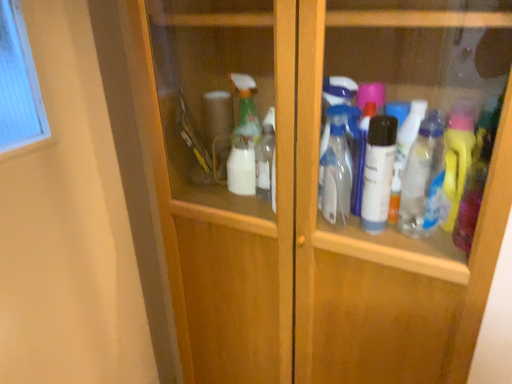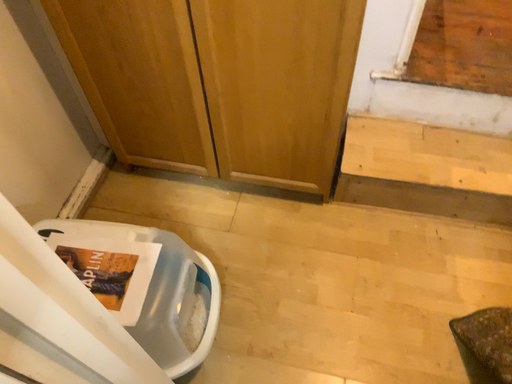
Question: Which way did the camera rotate in the video?

Choices:
 (A) rotated upward
 (B) rotated downward

Answer: (B)